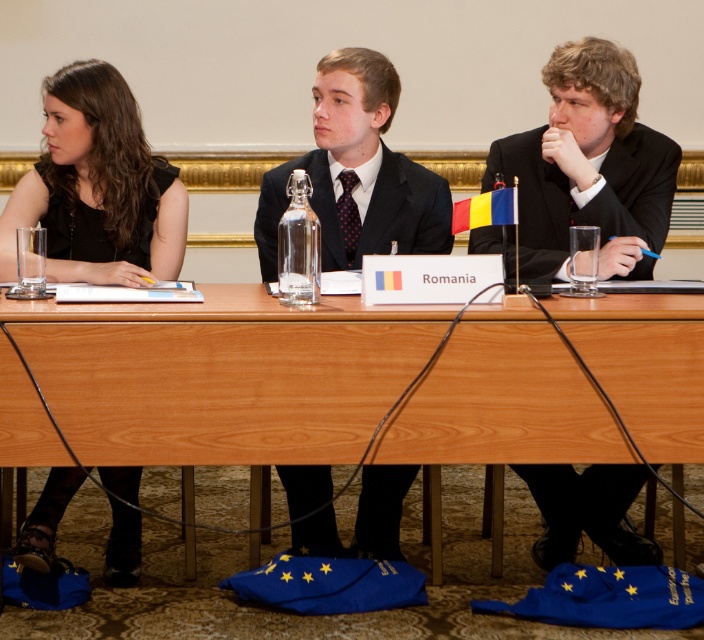
You are organizing a small meeting and need to place a 2.5 feet wide laptop on the wooden table at center. Considering the size of the matte black suit at center, will there be enough space for the laptop?

The wooden table at center has a larger size compared to the matte black suit at center, so there should be enough space to place the 2.5 feet wide laptop on the wooden table at center.

You are at a formal event and need to place a nameplate on the table. The nameplate is meant for the person wearing the black matte dress at left. Where should you place it relative to the wooden table at center?

The wooden table at center is to the right of the black matte dress at left, so you should place the nameplate to the left side of the wooden table at center to ensure it is near the person wearing the black matte dress at left.

You are sitting at the wooden table at center and want to pass a document to the matte black suit at center. In which direction should you move the document to reach them?

The wooden table at center is to the left of the matte black suit at center, so you should move the document to the right to reach them.